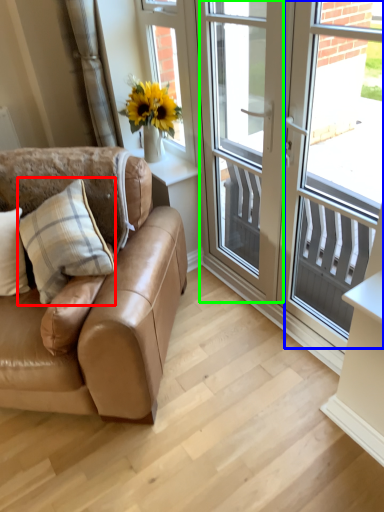
Question: Which object is positioned farthest from pillow (highlighted by a red box)? Select from window screen (highlighted by a blue box) and screen door (highlighted by a green box).

Choices:
 (A) window screen
 (B) screen door

Answer: (A)